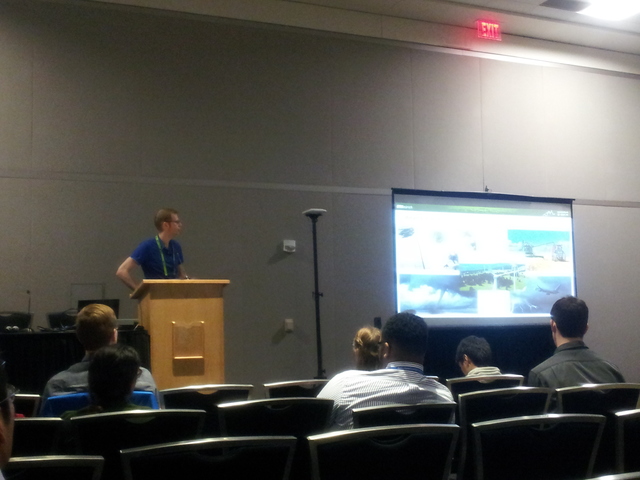
Locate an element on the screen. Image resolution: width=640 pixels, height=480 pixels. podium is located at coordinates (188, 293).